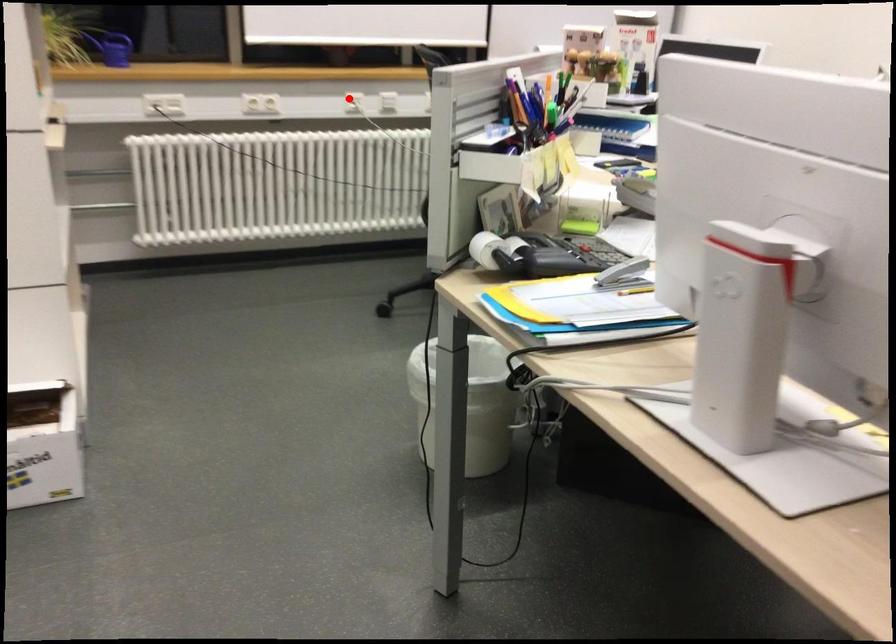
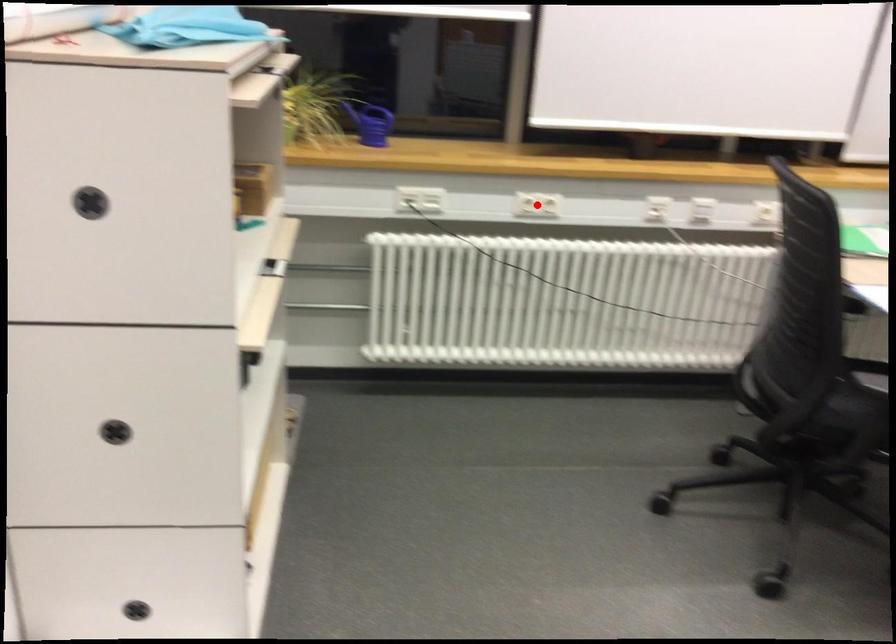
I am providing you with two images of the same scene from different viewpoints. A red point is marked on the first image and another point is marked on the second image. Is the marked point in image1 the same physical position as the marked point in image2?

No